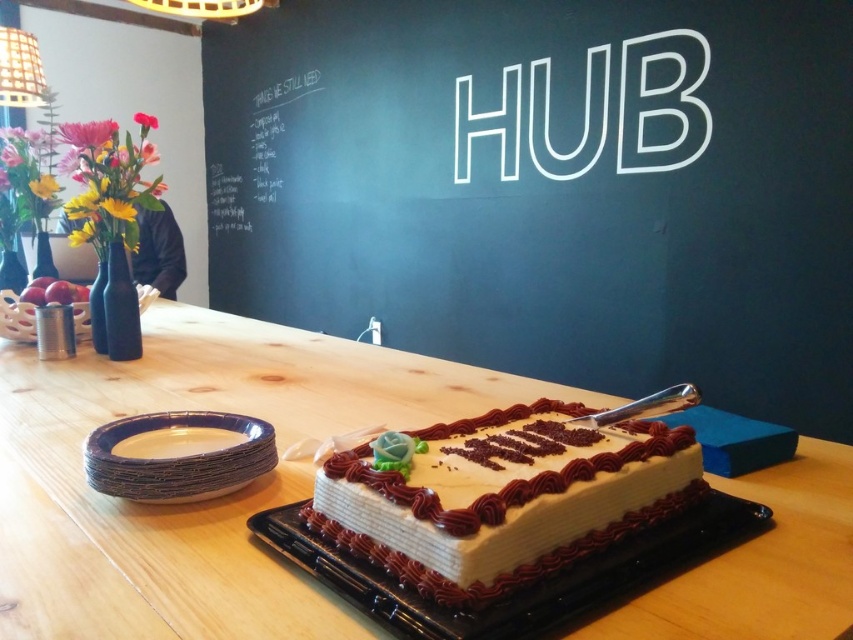
Question: Among these objects, which one is farthest from the camera?

Choices:
 (A) white paper plates at lower left
 (B) white frosted cake at center

Answer: (A)

Question: Does matte black chalkboard at center appear under wooden table at center?

Choices:
 (A) no
 (B) yes

Answer: (A)

Question: Estimate the real-world distances between objects in this image. Which object is farther from the wooden table at center?

Choices:
 (A) white frosted cake at center
 (B) white chalkboard at upper left

Answer: (B)

Question: Which point is closer to the camera?

Choices:
 (A) (231, 92)
 (B) (108, 481)
 (C) (241, 173)
 (D) (343, 486)

Answer: (D)

Question: Is white frosted cake at center positioned behind white chalkboard at upper left?

Choices:
 (A) no
 (B) yes

Answer: (A)

Question: Can you confirm if wooden table at center is bigger than white paper plates at lower left?

Choices:
 (A) no
 (B) yes

Answer: (B)